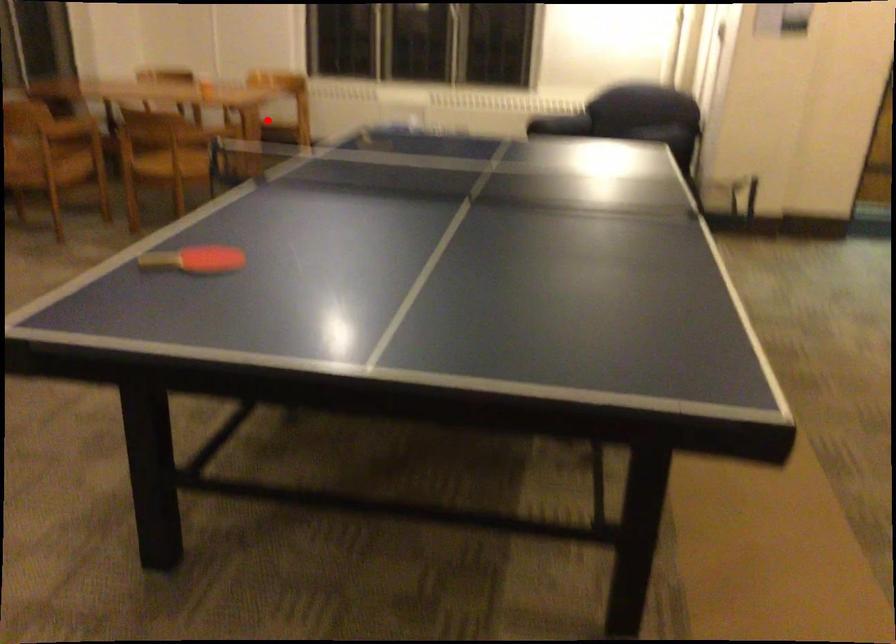
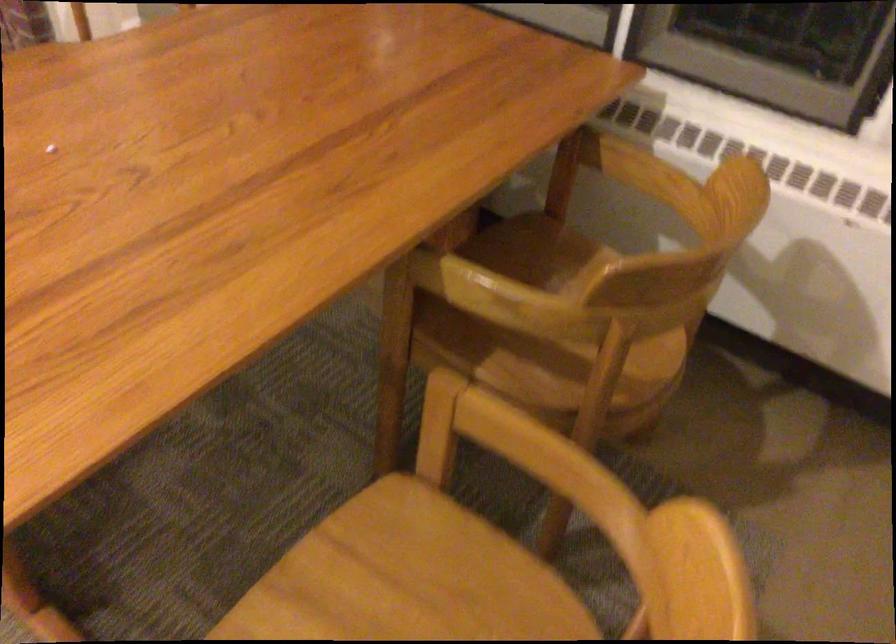
Question: I am providing you with two images of the same scene from different viewpoints. In image1, a red point is highlighted. Considering the same 3D point in image2, which of the following is correct?

Choices:
 (A) It is closer
 (B) It is farther

Answer: (A)